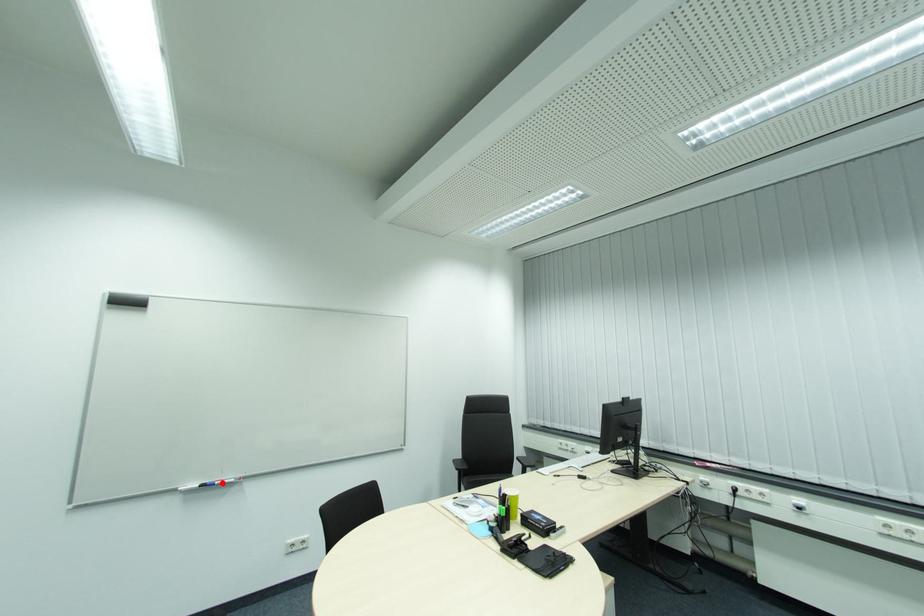
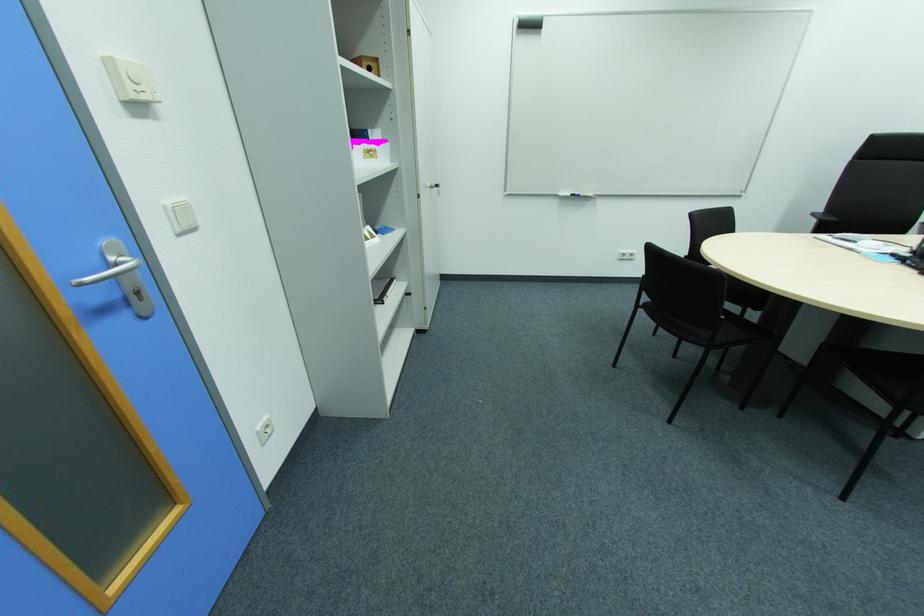
Find the pixel in the second image that matches the highlighted location in the first image.

(588, 195)